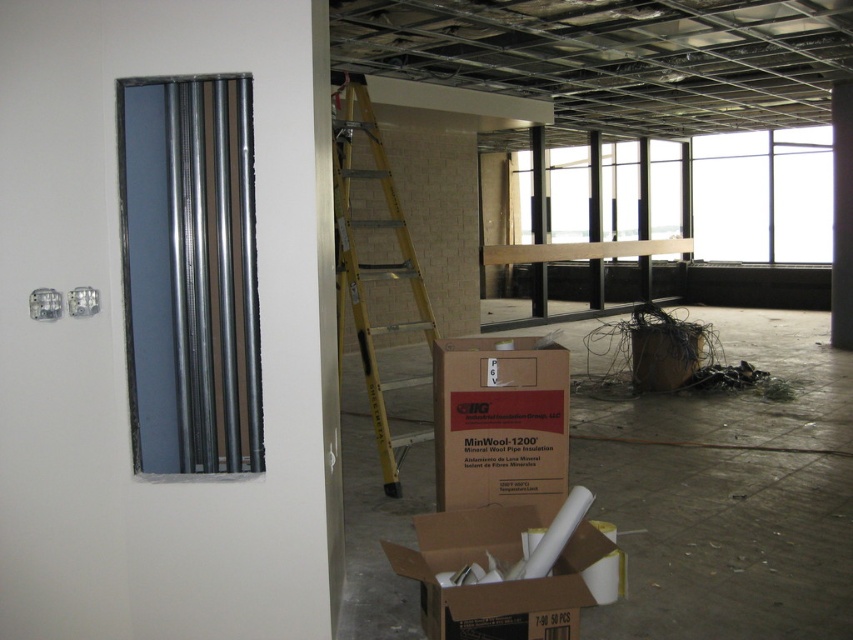
Question: Is brown cardboard box at center to the right of cardboard box at lower center from the viewer's perspective?

Choices:
 (A) yes
 (B) no

Answer: (B)

Question: Considering the real-world distances, which object is closest to the cardboard box at lower center?

Choices:
 (A) yellow fiberglass ladder at center
 (B) brown cardboard box at center-right
 (C) brown cardboard box at center

Answer: (C)

Question: Among these objects, which one is farthest from the camera?

Choices:
 (A) cardboard box at lower center
 (B) brown cardboard box at center-right

Answer: (B)

Question: Is cardboard box at lower center positioned in front of brown cardboard box at center-right?

Choices:
 (A) yes
 (B) no

Answer: (A)

Question: Is yellow fiberglass ladder at center below brown cardboard box at center-right?

Choices:
 (A) no
 (B) yes

Answer: (A)

Question: Among these points, which one is farthest from the camera?

Choices:
 (A) (416, 289)
 (B) (689, 344)
 (C) (393, 570)
 (D) (520, 413)

Answer: (B)